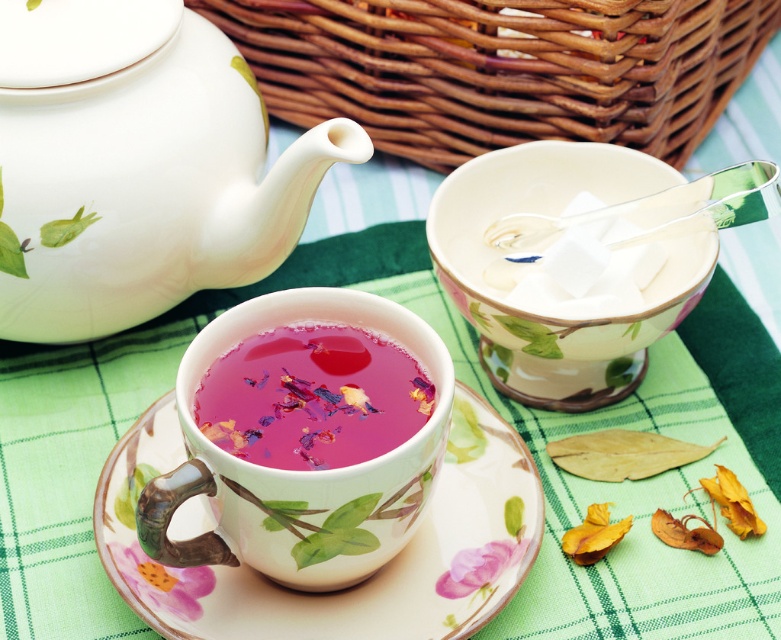
You are a tea server preparing to pour tea from the white glossy teapot at upper left into the porcelain saucer at center. Will the teapot fit over the saucer without spilling?

The white glossy teapot at upper left is thinner than the porcelain saucer at center, so it can fit over the saucer without spilling.

You are setting up a tea service and need to determine if the white glossy teapot at upper left can fit on a tray designed to hold the porcelain saucer at center. Based on their sizes, will the teapot fit?

The white glossy teapot at upper left is bigger than the porcelain saucer at center, so it may not fit on the tray designed for the saucer.

You are a tea enthusiast who wants to add honey to your tea. You have a small honey jar placed behind the pink floral tea at center. Can you reach the honey jar without moving the matte porcelain teacup at center?

The matte porcelain teacup at center is in front of the pink floral tea at center, so the honey jar is behind the pink floral tea at center. Therefore, you can reach the honey jar without moving the matte porcelain teacup at center because the honey jar is behind the pink floral tea, which is behind the teacup.